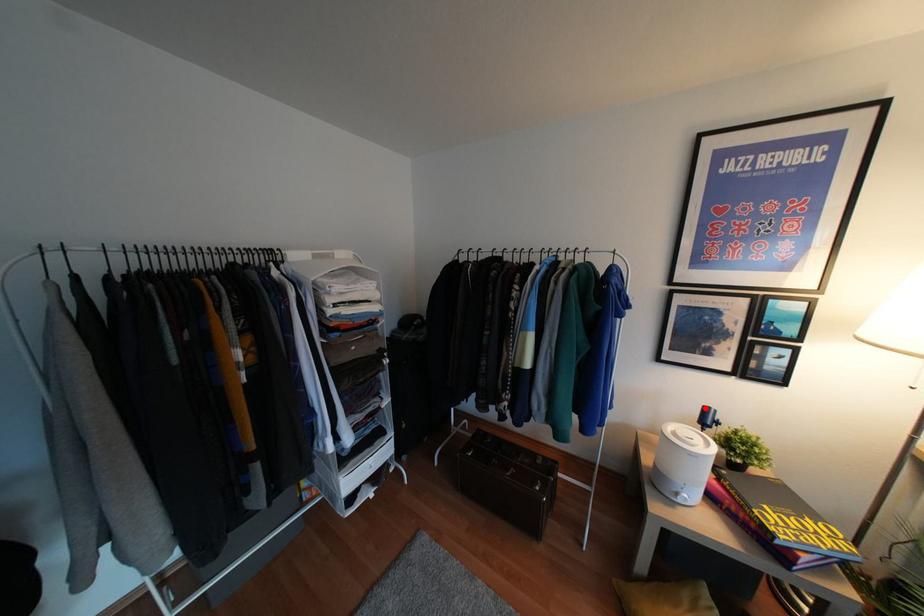
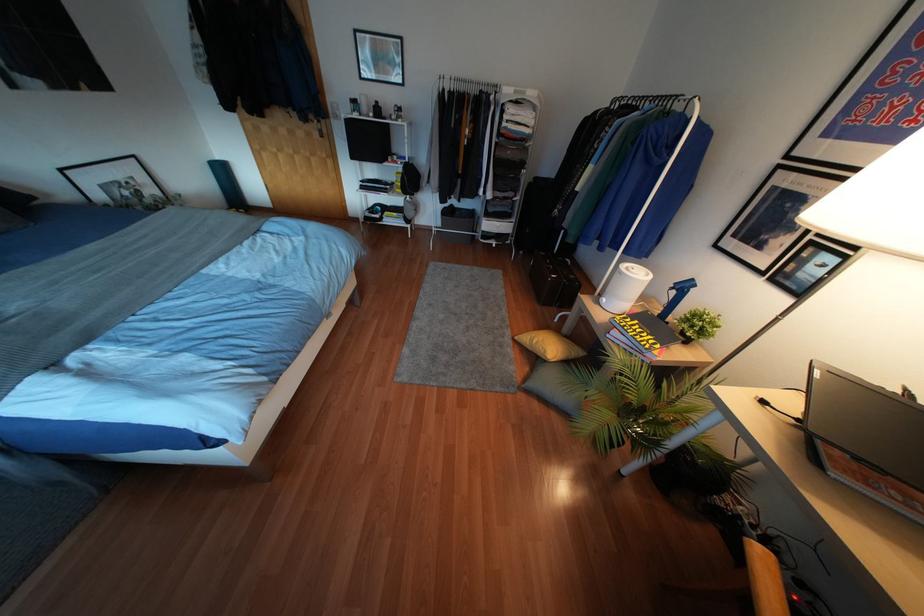
Where in the second image is the point corresponding to the highlighted location from the first image?

(690, 280)